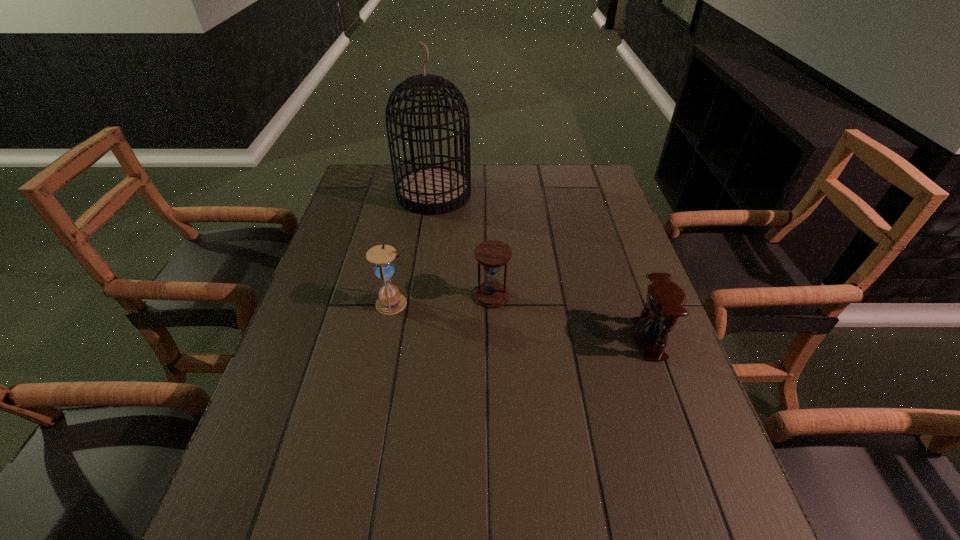
In order to click on the farthest object in this screenshot , I will do `click(432, 190)`.

Where is `birdcage`? birdcage is located at coordinates (432, 190).

Locate an element on the screen. Image resolution: width=960 pixels, height=540 pixels. the leftmost hourglass is located at coordinates (390, 302).

The image size is (960, 540). In order to click on the second tallest object in this screenshot , I will do `click(390, 302)`.

I want to click on the nearest hourglass, so click(x=665, y=299).

Locate an element on the screen. the rightmost object is located at coordinates (665, 299).

Identify the location of the second object from right to left. point(492,254).

This screenshot has height=540, width=960. I want to click on blank area located 0.340m on the right of the birdcage, so click(570, 194).

This screenshot has height=540, width=960. Find the location of `vacant space located on the right of the tallest hourglass`. vacant space located on the right of the tallest hourglass is located at coordinates (565, 303).

Identify the location of free space located 0.100m on the left of the rightmost object. The width and height of the screenshot is (960, 540). (590, 339).